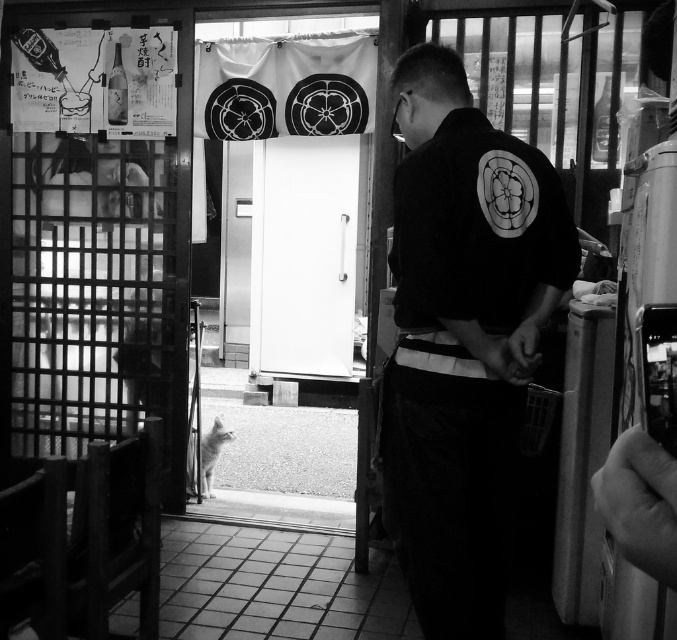
You are standing at the entrance of the traditional Japanese establishment. There are two points marked in the image. One is at coordinate point (x=393, y=355) and the other at point (x=280, y=308). Which point is closer to you, the observer?

Point (x=393, y=355) is in front of point (x=280, y=308), so it is closer to you.

You are a customer entering the establishment and notice the black cotton shirt at center and the white smooth door at center. Which object is wider?

The white smooth door at center is wider than the black cotton shirt at center.

You are a customer standing outside the entrance of this traditional Japanese establishment. You see a black cotton shirt at center and a white smooth door at center. Which object is closer to the entrance from your perspective?

The white smooth door at center is closer to the entrance because the black cotton shirt at center is to the right of it, meaning the door is between you and the shirt.